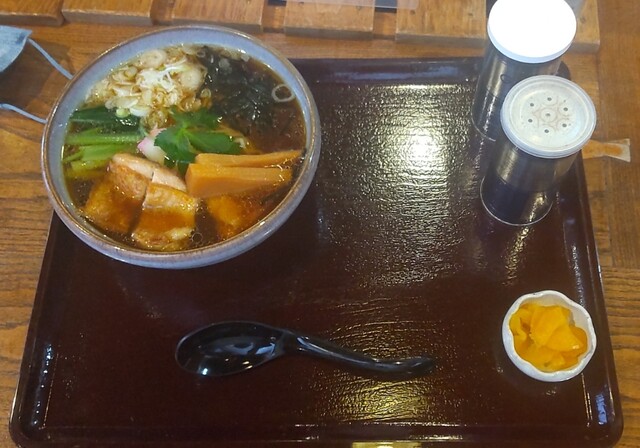
Where is `bowls`? This screenshot has width=640, height=448. bowls is located at coordinates 281,217, 512,357.